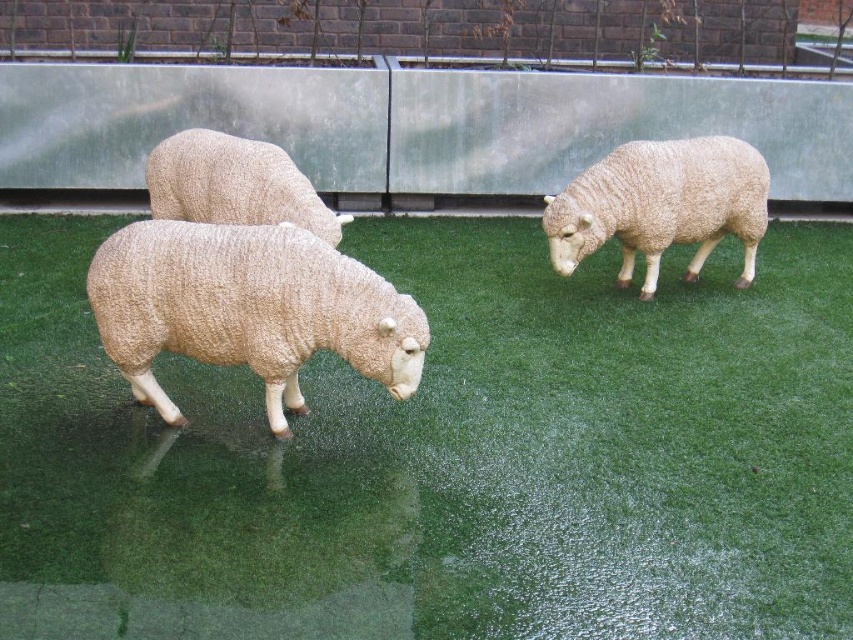
You are a gardener who needs to place a 1.2 meter long decorative bench in this area. Given the space between the green artificial grass at center and the fuzzy woolen sheep at center, will the bench fit without overlapping either object?

The distance between the green artificial grass at center and the fuzzy woolen sheep at center is 1.19 meters. Since the bench is 1.2 meters long, it would not fit in the space between them without overlapping one or both objects.

You are a gardener who wants to plant flowers on the green artificial grass at center where the white woolen sheep at center is standing. Is there enough space to plant flowers there?

The green artificial grass at center is positioned under the white woolen sheep at center, so the sheep is currently occupying that space. You would need to move the sheep to plant flowers there.